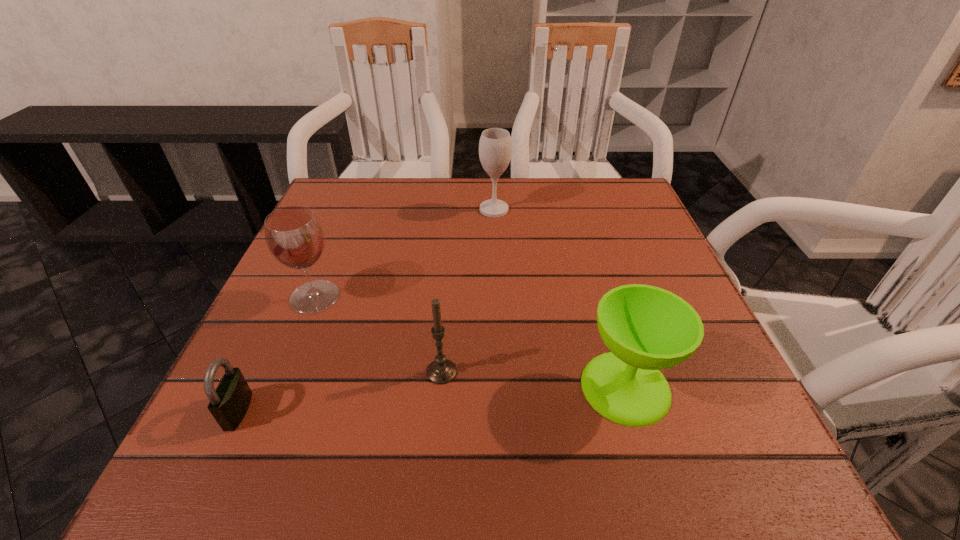
Where is `blank region between the second wineglass from right to left and the padlock`? This screenshot has width=960, height=540. blank region between the second wineglass from right to left and the padlock is located at coordinates (366, 310).

Find the location of a particular element. free space between the padlock and the rightmost wineglass is located at coordinates (432, 399).

I want to click on blank region between the second object from right to left and the second farthest object, so click(404, 253).

Locate an element on the screen. The width and height of the screenshot is (960, 540). vacant space that is in between the candle and the farthest wineglass is located at coordinates (468, 291).

I want to click on free space between the fourth object from left to right and the second farthest wineglass, so click(404, 253).

At what (x,y) coordinates should I click in order to perform the action: click on unoccupied position between the leftmost wineglass and the nearest wineglass. Please return your answer as a coordinate pair (x, y). The image size is (960, 540). Looking at the image, I should click on (470, 342).

Point out which object is positioned as the nearest to the shortest object. Please provide its 2D coordinates. Your answer should be formatted as a tuple, i.e. [(x, y)], where the tuple contains the x and y coordinates of a point satisfying the conditions above.

[(294, 236)]

At what (x,y) coordinates should I click in order to perform the action: click on the closest object to the third object from left to right. Please return your answer as a coordinate pair (x, y). The height and width of the screenshot is (540, 960). Looking at the image, I should click on (646, 328).

The image size is (960, 540). Find the location of `the closest wineglass to the third object from right to left`. the closest wineglass to the third object from right to left is located at coordinates (646, 328).

Image resolution: width=960 pixels, height=540 pixels. In order to click on wineglass that stands as the closest to the nearest wineglass in this screenshot , I will do `click(495, 146)`.